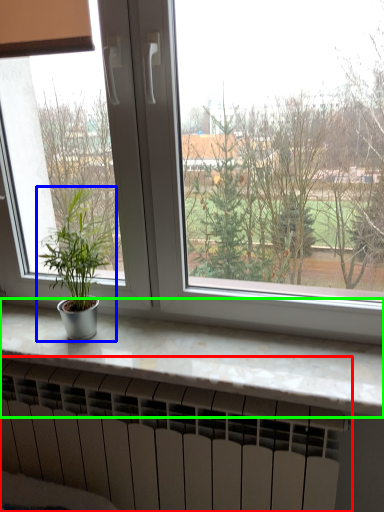
Question: Which is farther away from heater (highlighted by a red box)? houseplant (highlighted by a blue box) or counter top (highlighted by a green box)?

Choices:
 (A) houseplant
 (B) counter top

Answer: (A)